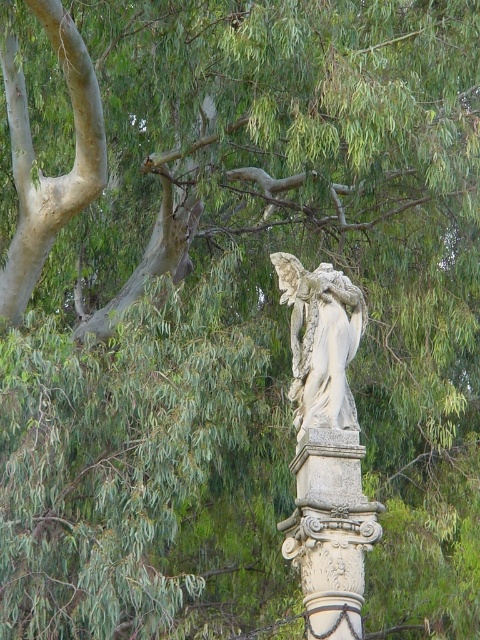
You are a painter standing 10 feet away from the carved stone column at center. You want to paint the white stone angel at center. Can you reach the angel without moving closer than your current position?

The carved stone column at center is 12.40 feet from the white stone angel at center. Since you are currently 10 feet away from the column, the total distance to the angel would be 10 feet plus 12.40 feet, totaling 22.40 feet. At this distance, it may be challenging to paint the angel in detail without moving closer, but you can still reach it from your current position.

You are an architect examining the outdoor classical statue area. You notice the carved stone column at center and the white stone angel at center. Which object is larger in size?

The white stone angel at center is larger than the carved stone column at center.

You are an art student sketching the scene. You need to draw the carved stone column at center and the white stone angel at center. Based on their positions, which object should you draw first to maintain proper perspective?

The carved stone column at center is to the left of the white stone angel at center, so you should draw the carved stone column at center first as it is closer to the left side of the canvas to establish the perspective properly.